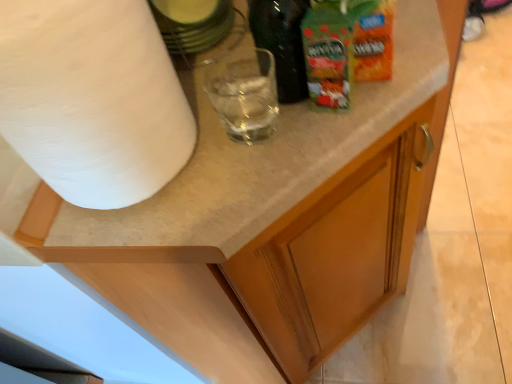
Locate an element on the screen. free space on the front side of white matte paper towel at upper left is located at coordinates (170, 220).